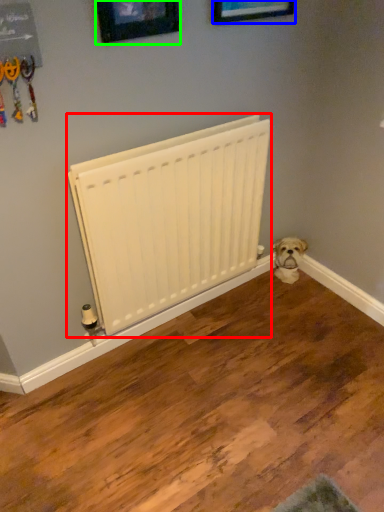
Question: Which object is positioned farthest from radiator (highlighted by a red box)? Select from picture frame (highlighted by a blue box) and picture frame (highlighted by a green box).

Choices:
 (A) picture frame
 (B) picture frame

Answer: (A)